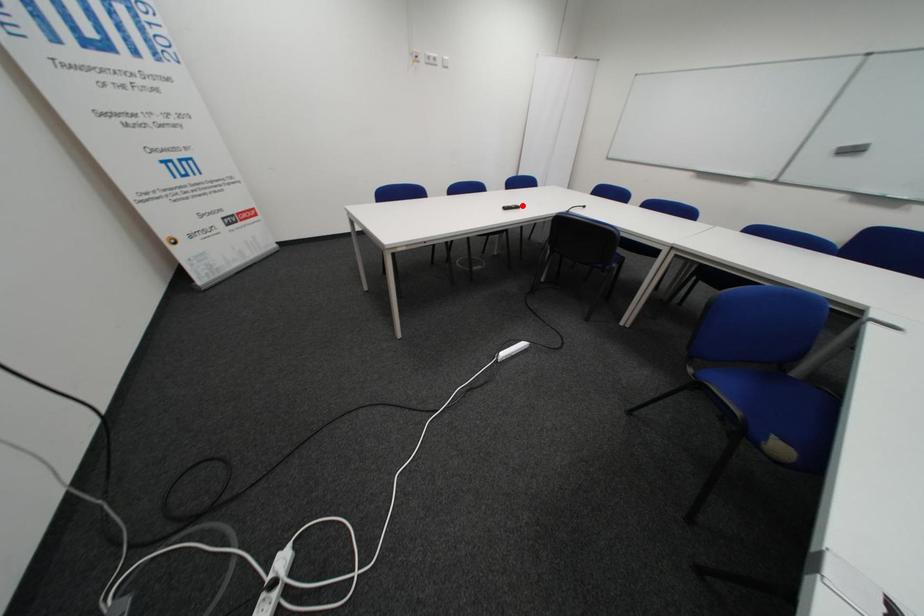
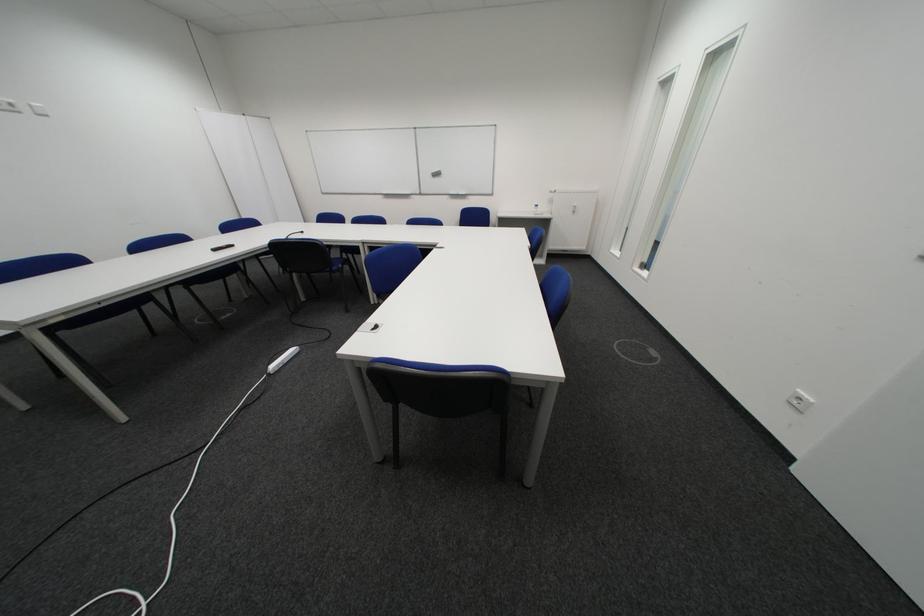
Find the pixel in the second image that matches the highlighted location in the first image.

(233, 246)